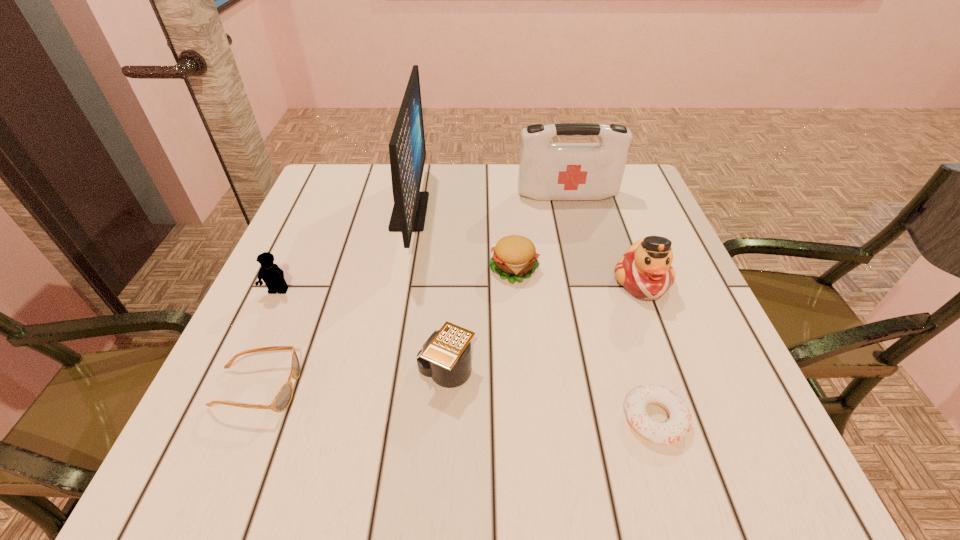
Locate an element on the screen. the third object from left to right is located at coordinates (407, 151).

Where is `the tallest object`? The image size is (960, 540). the tallest object is located at coordinates (407, 151).

You are a GUI agent. You are given a task and a screenshot of the screen. Output one action in this format:
    pyautogui.click(x=<x>, y=<y>)
    Task: Click on the second tallest object
    This screenshot has height=540, width=960.
    Given the screenshot: What is the action you would take?
    pyautogui.click(x=547, y=171)

This screenshot has height=540, width=960. Identify the location of the third tallest object. (645, 271).

Locate an element on the screen. Lego is located at coordinates (273, 276).

At what (x,y) coordinates should I click in order to perform the action: click on the fifth object from right to left. Please return your answer as a coordinate pair (x, y). The image size is (960, 540). Looking at the image, I should click on (445, 356).

Locate an element on the screen. hamburger is located at coordinates (514, 257).

What are the coordinates of `sunglasses` in the screenshot? It's located at (x=282, y=400).

The width and height of the screenshot is (960, 540). What are the coordinates of `doughnut` in the screenshot? It's located at (679, 423).

What are the coordinates of `free space located 0.120m on the screen side of the third object from left to right` in the screenshot? It's located at (474, 212).